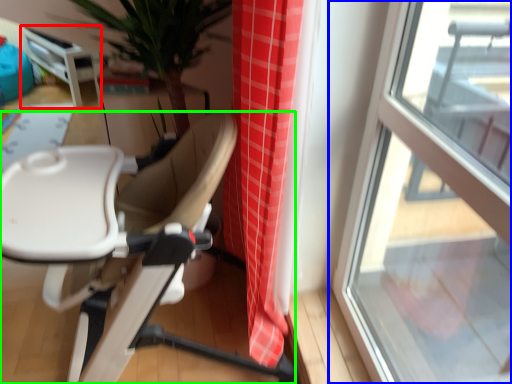
Question: Considering the real-world distances, which object is closest to table (highlighted by a red box)? window (highlighted by a blue box) or chair (highlighted by a green box).

Choices:
 (A) window
 (B) chair

Answer: (B)